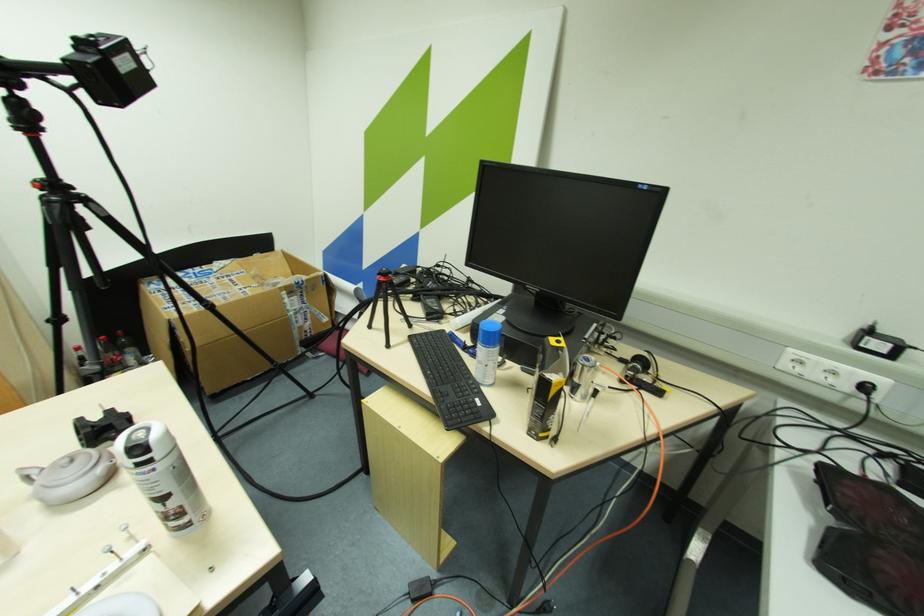
Identify the location of red-cap plastic bottle. This screenshot has height=616, width=924. (108, 352).